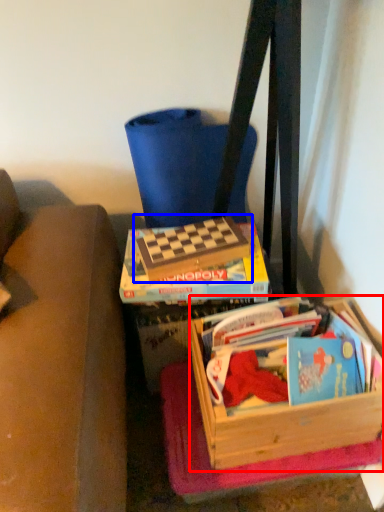
Question: Which of the following is the closest to the observer, box (highlighted by a red box) or paperback book (highlighted by a blue box)?

Choices:
 (A) box
 (B) paperback book

Answer: (A)